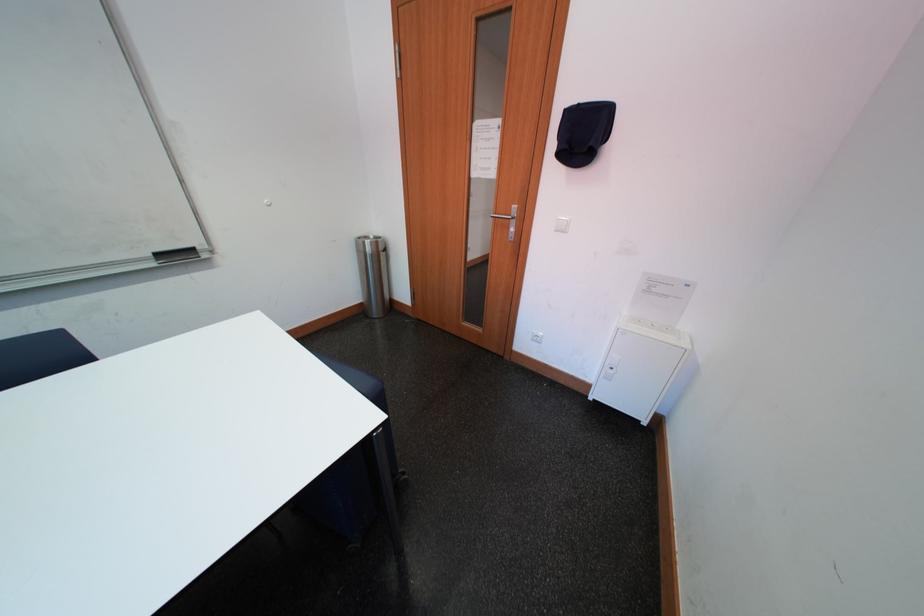
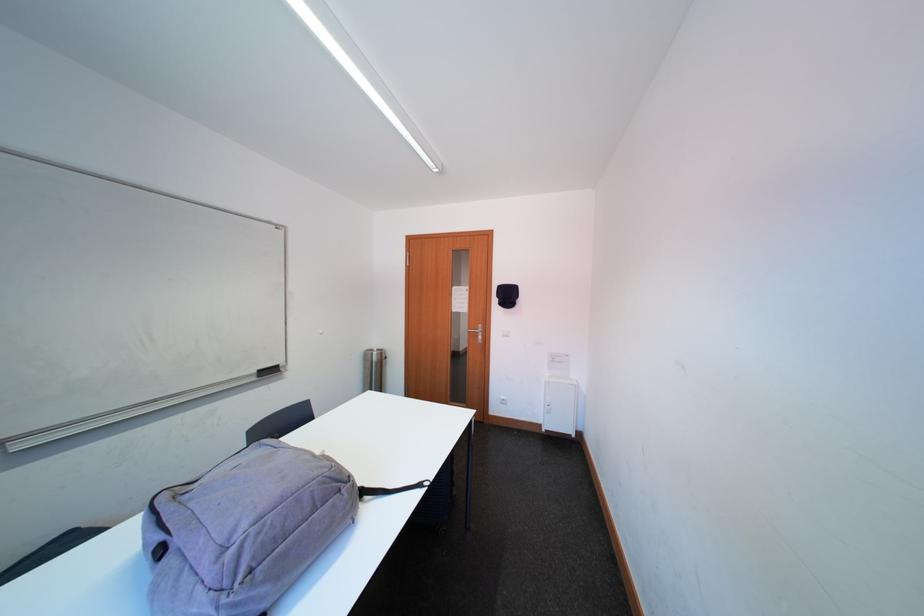
Find the pixel in the second image that matches the point at 167,257 in the first image.

(269, 375)